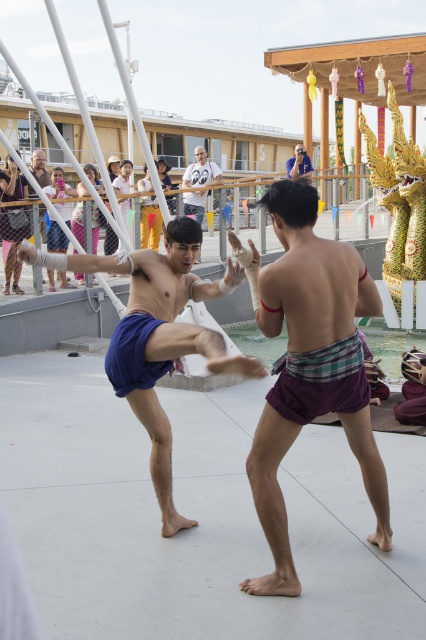
Is purple plaid shorts at center taller than light blue shirt at upper center?

No.

Is point (305, 212) positioned after point (304, 179)?

No, (305, 212) is closer to viewer.

I want to click on purple plaid shorts at center, so click(x=308, y=365).

Can you confirm if blue cotton shorts at center is taller than light blue shirt at upper center?

No, blue cotton shorts at center is not taller than light blue shirt at upper center.

Is blue cotton shorts at center to the right of light blue shirt at upper center from the viewer's perspective?

No, blue cotton shorts at center is not to the right of light blue shirt at upper center.

Is point (83, 259) positioned after point (290, 161)?

No, it is not.

This screenshot has height=640, width=426. Find the location of `blue cotton shorts at center`. blue cotton shorts at center is located at coordinates (158, 337).

How much distance is there between blue cotton shorts at center and white cotton shirt at center?

blue cotton shorts at center is 9.54 meters from white cotton shirt at center.

Between blue cotton shorts at center and white cotton shirt at center, which one is positioned higher?

Positioned higher is white cotton shirt at center.

Is point (180, 264) in front of point (201, 204)?

Yes, it is in front of point (201, 204).

Locate an element on the screen. This screenshot has width=426, height=640. blue cotton shorts at center is located at coordinates (158, 337).